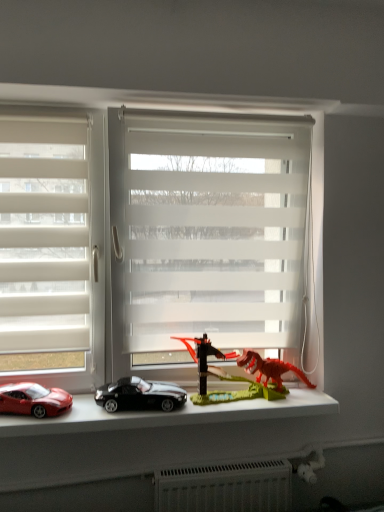
Question: Is point (130, 401) closer or farther from the camera than point (198, 354)?

Choices:
 (A) farther
 (B) closer

Answer: (B)

Question: Is shiny black car at center, placed as the first car when sorted from right to left, situated inside rubberized red dinosaur at center or outside?

Choices:
 (A) inside
 (B) outside

Answer: (B)

Question: Estimate the real-world distances between objects in this image. Which object is closer to the shiny red car at lower left, which is the first car from left to right?

Choices:
 (A) metallic white window sill at lower center
 (B) shiny black car at center, placed as the first car when sorted from right to left
 (C) white translucent blinds at center, arranged as the first window when viewed from the right
 (D) white translucent blinds at left, which ranks as the second window in right-to-left order
 (E) rubberized red dinosaur at center

Answer: (A)

Question: Estimate the real-world distances between objects in this image. Which object is farther from the metallic white window sill at lower center?

Choices:
 (A) white translucent blinds at center, arranged as the first window when viewed from the right
 (B) rubberized red dinosaur at center
 (C) shiny red car at lower left, placed as the 2th car when sorted from right to left
 (D) shiny black car at center, the 2th car from the left
 (E) white translucent blinds at left, which ranks as the second window in right-to-left order

Answer: (E)